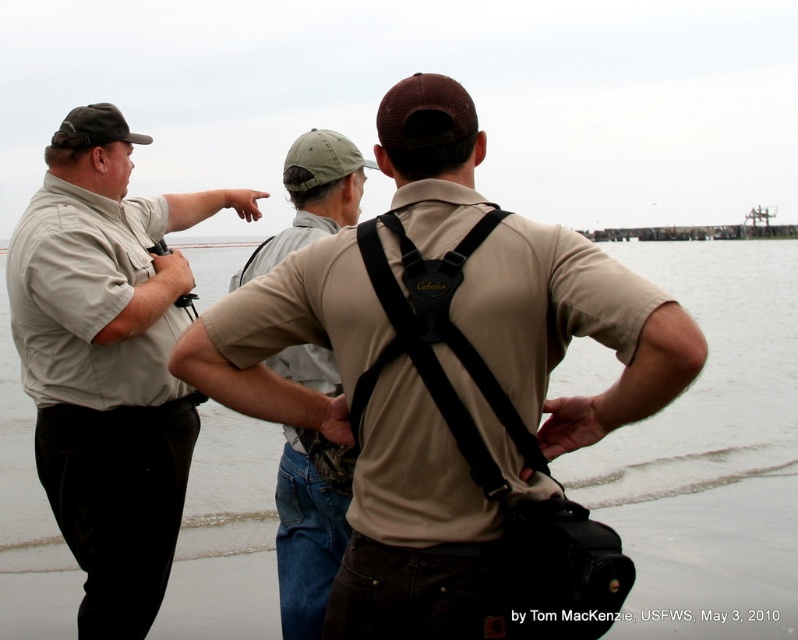
From the picture: Does tan fabric shirt at center come in front of matte khaki shirt at left?

Yes, it is.

Can you confirm if tan fabric shirt at center is bigger than matte khaki shirt at left?

No.

Which is behind, point (445, 248) or point (65, 172)?

Point (65, 172)

Identify the location of tan fabric shirt at center. (452, 388).

Measure the distance between matte khaki shirt at left and camera.

A distance of 4.71 meters exists between matte khaki shirt at left and camera.

Where is `matte khaki shirt at left`? The width and height of the screenshot is (798, 640). matte khaki shirt at left is located at coordinates (109, 362).

At what (x,y) coordinates should I click in order to perform the action: click on matte khaki shirt at left. Please return your answer as a coordinate pair (x, y). The width and height of the screenshot is (798, 640). Looking at the image, I should click on (109, 362).

Where is `tan fabric shirt at center`? The width and height of the screenshot is (798, 640). tan fabric shirt at center is located at coordinates (452, 388).

Can you confirm if tan fabric shirt at center is wider than khaki cotton shirt at center?

Correct, the width of tan fabric shirt at center exceeds that of khaki cotton shirt at center.

Identify the location of tan fabric shirt at center. (452, 388).

The width and height of the screenshot is (798, 640). I want to click on tan fabric shirt at center, so click(452, 388).